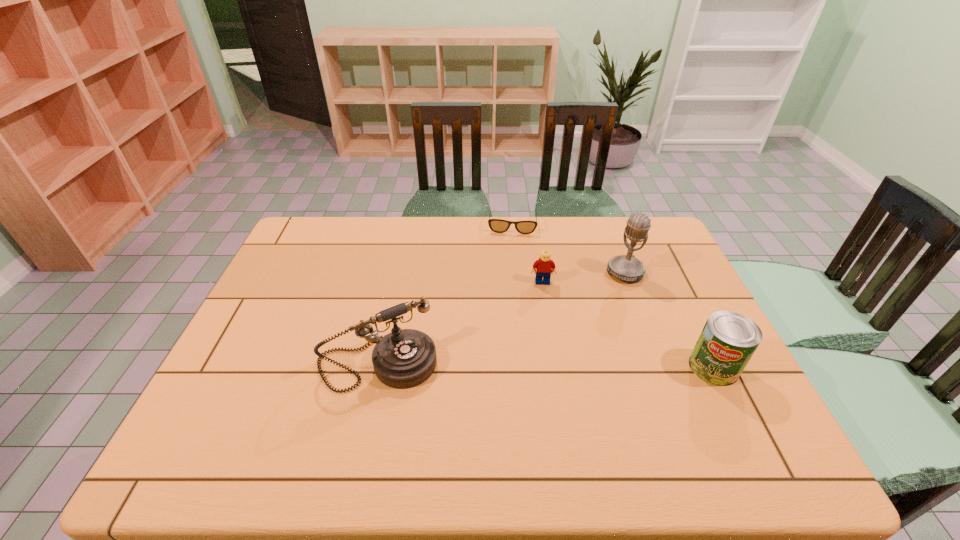
You are a GUI agent. You are given a task and a screenshot of the screen. Output one action in this format:
    pyautogui.click(x=<x>, y=<y>)
    Task: Click on the telephone
    This screenshot has height=540, width=960.
    Given the screenshot: What is the action you would take?
    pyautogui.click(x=405, y=358)

What are the coordinates of `the rightmost object` in the screenshot? It's located at (728, 340).

This screenshot has height=540, width=960. Identify the location of the tallest object. (628, 268).

At what (x,y) coordinates should I click in order to perform the action: click on the fourth object from left to right. Please return your answer as a coordinate pair (x, y). The width and height of the screenshot is (960, 540). Looking at the image, I should click on (628, 268).

Identify the location of the farthest object. (496, 225).

The image size is (960, 540). Find the location of `sunglasses`. sunglasses is located at coordinates coord(496,225).

Where is `Lego`? Lego is located at coordinates (543, 268).

At what (x,y) coordinates should I click in order to perform the action: click on vacant space located on the right of the telephone. Please return your answer as a coordinate pair (x, y). Looking at the image, I should click on (472, 364).

I want to click on vacant space located on the left of the can, so click(631, 367).

I want to click on vacant space located on the front-facing side of the microphone, so 556,326.